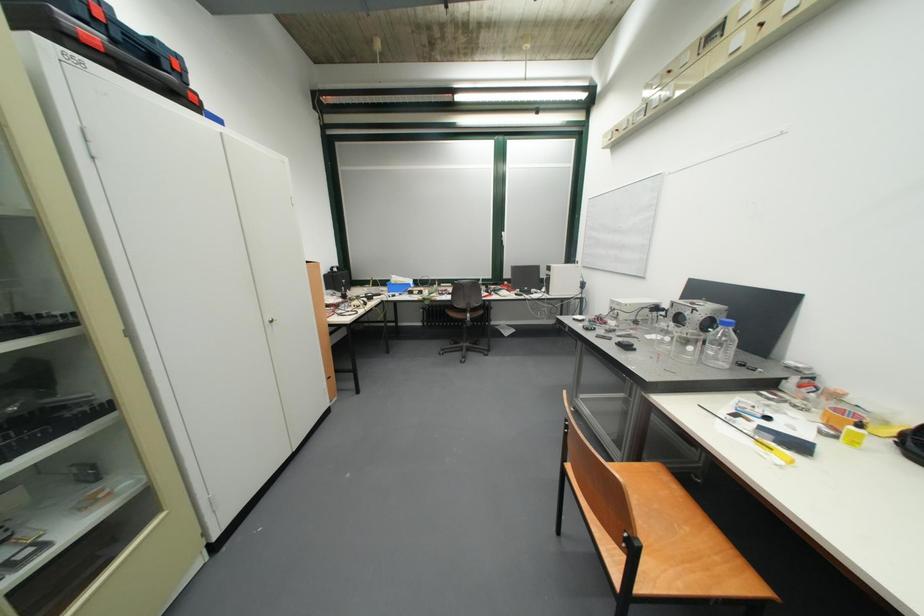
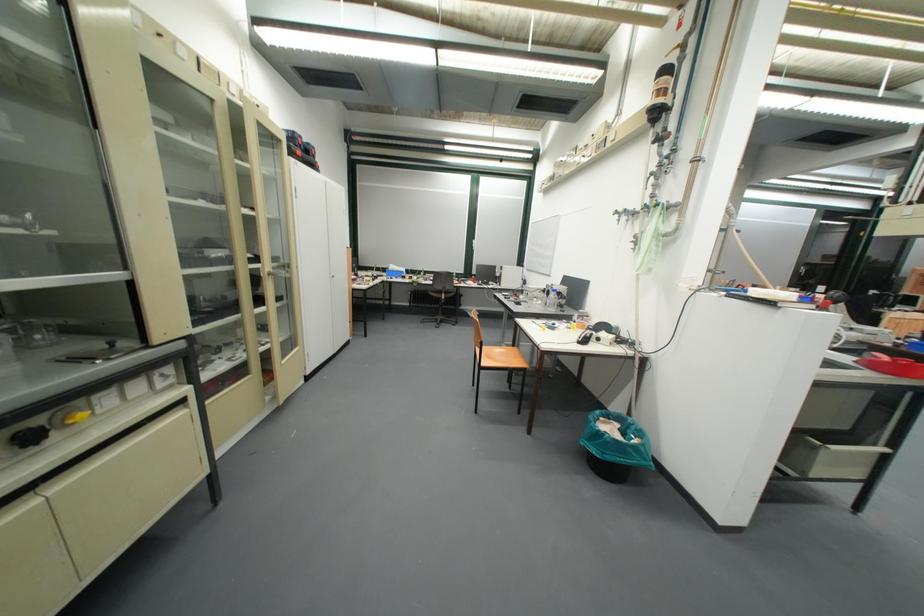
Where in the second image is the point corresponding to [55,45] from the first image?

(304, 161)